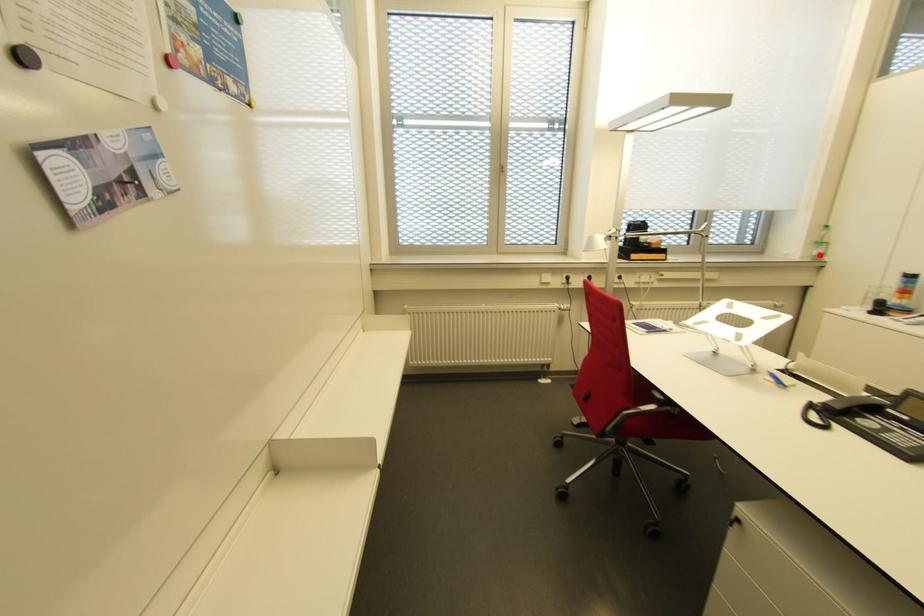
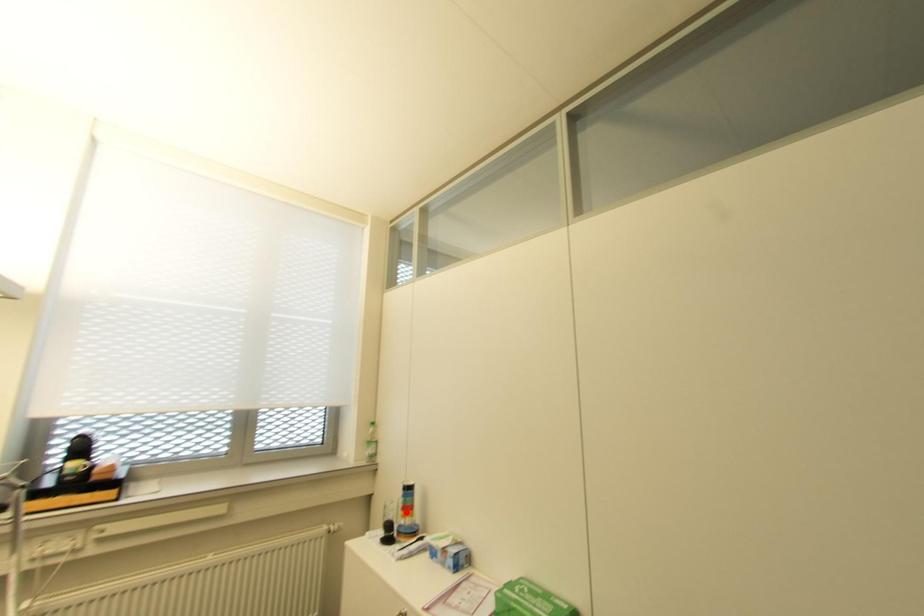
I am providing you with two images of the same scene from different viewpoints. A red point is marked on the first image and another point is marked on the second image. Do the highlighted points in image1 and image2 indicate the same real-world spot?

No